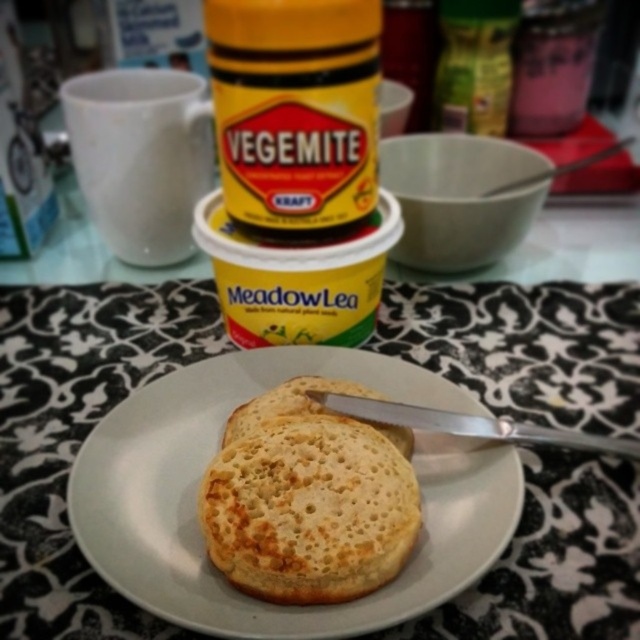
Question: Estimate the real-world distances between objects in this image. Which object is farther from the golden brown crumbly biscuit at center?

Choices:
 (A) golden-brown crispy pancake at center
 (B) silver metallic knife at center
 (C) white matte mug at upper left

Answer: (C)

Question: Can you confirm if white matte mug at upper left is thinner than golden brown crumbly biscuit at center?

Choices:
 (A) no
 (B) yes

Answer: (A)

Question: Which object appears closest to the camera in this image?

Choices:
 (A) white matte plate at center
 (B) golden-brown crispy pancake at center
 (C) silver metallic knife at center
 (D) white matte mug at upper left

Answer: (A)

Question: Can you confirm if golden-brown crispy pancake at center is positioned below white matte mug at upper left?

Choices:
 (A) yes
 (B) no

Answer: (A)

Question: Which point is farther to the camera?

Choices:
 (A) (323, 410)
 (B) (256, 618)

Answer: (A)

Question: Does white matte plate at center have a greater width compared to silver metallic knife at center?

Choices:
 (A) yes
 (B) no

Answer: (A)